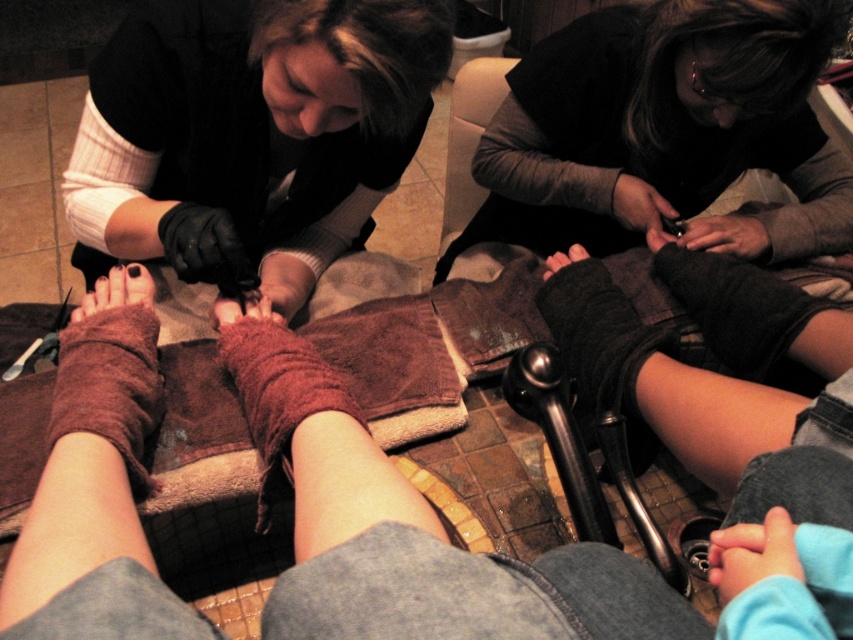
You are a customer at the spa and want to grab the black fuzzy socks at lower center. You are currently holding the matte black gloves at upper center. Can you reach the socks without letting go of the gloves?

The matte black gloves at upper center is 11.48 inches away from black fuzzy socks at lower center. Since the distance is relatively short, you can likely reach the socks while still holding the gloves.

You are a client whose foot is being treated by the professional at point [119,416]. You need to reach for a tissue located at point [747,252]. Can you easily reach it without moving your body?

Point [119,416] is in front of point [747,252], so the tissue is behind the professional at point [119,416]. You may need to move your body or ask for assistance to reach it.

You are a spa attendant and need to choose between the brown suede foot at center and the brown fuzzy socks at lower left for a foot treatment. Which one is larger in size?

The brown suede foot at center is bigger than the brown fuzzy socks at lower left, so you should choose the brown suede foot at center for the foot treatment as it is larger in size.